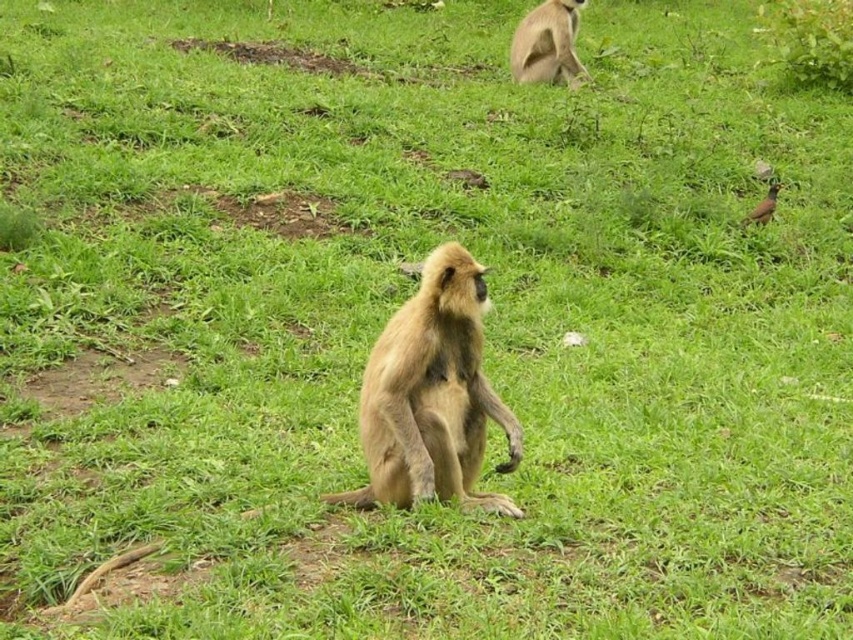
Question: Which object appears farthest from the camera in this image?

Choices:
 (A) light brown fur monkey at upper center
 (B) golden fur monkey at center

Answer: (A)

Question: Is golden fur monkey at center further to camera compared to light brown fur monkey at upper center?

Choices:
 (A) yes
 (B) no

Answer: (B)

Question: Does golden fur monkey at center have a lesser width compared to light brown fur monkey at upper center?

Choices:
 (A) yes
 (B) no

Answer: (B)

Question: Which of the following is the closest to the observer?

Choices:
 (A) (407, 376)
 (B) (566, 35)

Answer: (A)

Question: Does golden fur monkey at center have a greater width compared to light brown fur monkey at upper center?

Choices:
 (A) yes
 (B) no

Answer: (A)

Question: Which object is closer to the camera taking this photo?

Choices:
 (A) light brown fur monkey at upper center
 (B) golden fur monkey at center

Answer: (B)